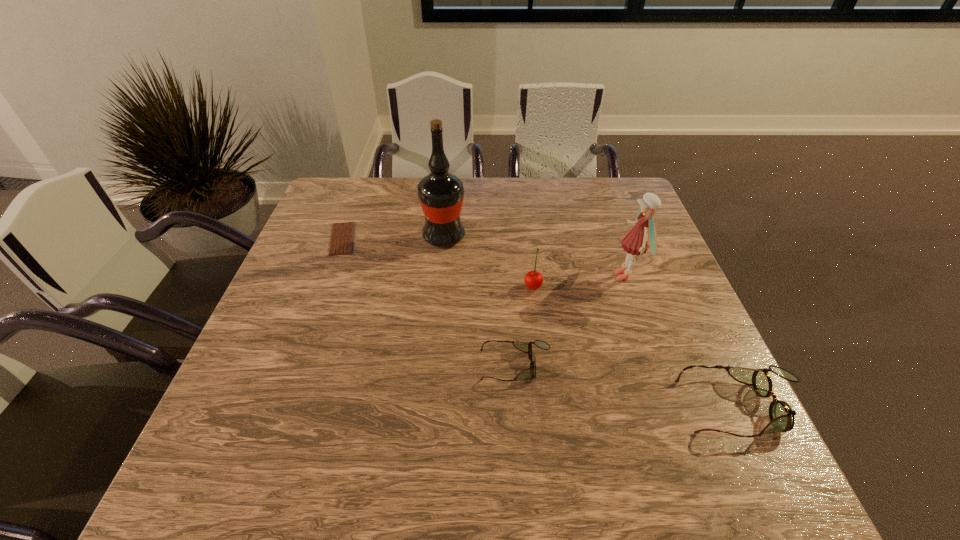
The width and height of the screenshot is (960, 540). What are the coordinates of `free location located on the front-facing side of the shorter spectacles` in the screenshot? It's located at (329, 366).

Find the location of a particular element. The width and height of the screenshot is (960, 540). vacant space situated on the front-facing side of the shorter spectacles is located at coordinates (367, 366).

You are a GUI agent. You are given a task and a screenshot of the screen. Output one action in this format:
    pyautogui.click(x=<x>, y=<y>)
    Task: Click on the vacant space located 0.380m on the front-facing side of the shorter spectacles
    This screenshot has height=540, width=960.
    Given the screenshot: What is the action you would take?
    pyautogui.click(x=301, y=366)

Identify the location of free location located on the front-facing side of the third shortest object. The height and width of the screenshot is (540, 960). (530, 407).

This screenshot has height=540, width=960. Find the location of `free location located 0.400m on the front-facing side of the third shortest object`. free location located 0.400m on the front-facing side of the third shortest object is located at coordinates (479, 407).

Locate an element on the screen. vacant space located 0.320m on the front-facing side of the third shortest object is located at coordinates (520, 407).

Find the location of a particular element. vacant space located 0.290m on the front-facing side of the doll is located at coordinates (500, 276).

Locate an element on the screen. The height and width of the screenshot is (540, 960). vacant space located on the front-facing side of the doll is located at coordinates (468, 276).

Find the location of `free point located 0.270m on the front-facing side of the doll`. free point located 0.270m on the front-facing side of the doll is located at coordinates (508, 276).

The height and width of the screenshot is (540, 960). I want to click on vacant area located on the front of the shortest object, so click(307, 333).